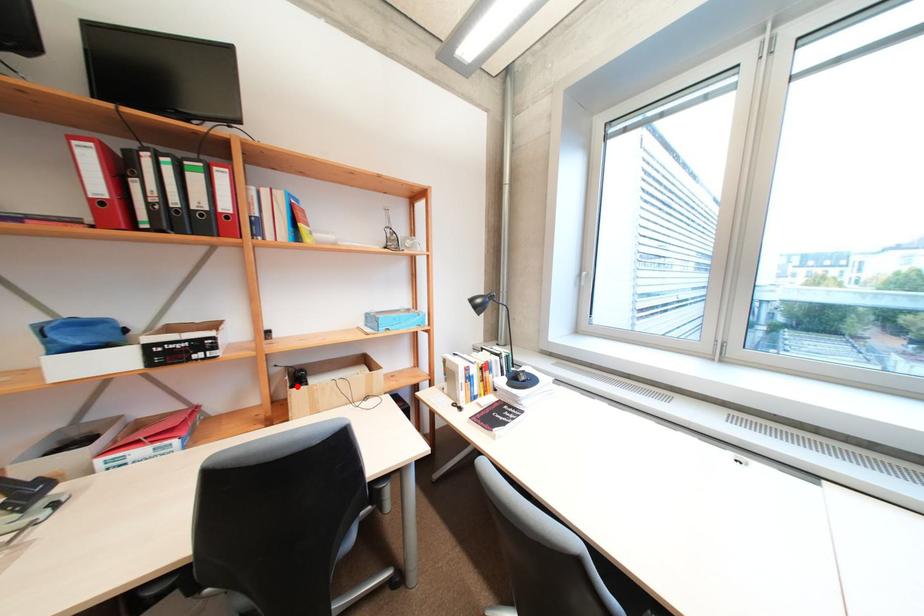
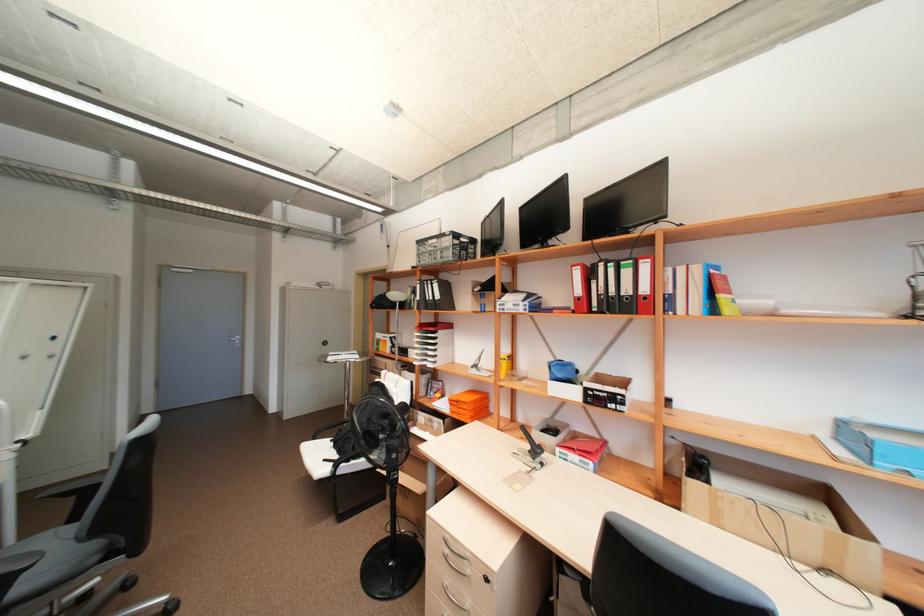
In the second image, find the point that corresponds to the highlighted location in the first image.

(695, 475)